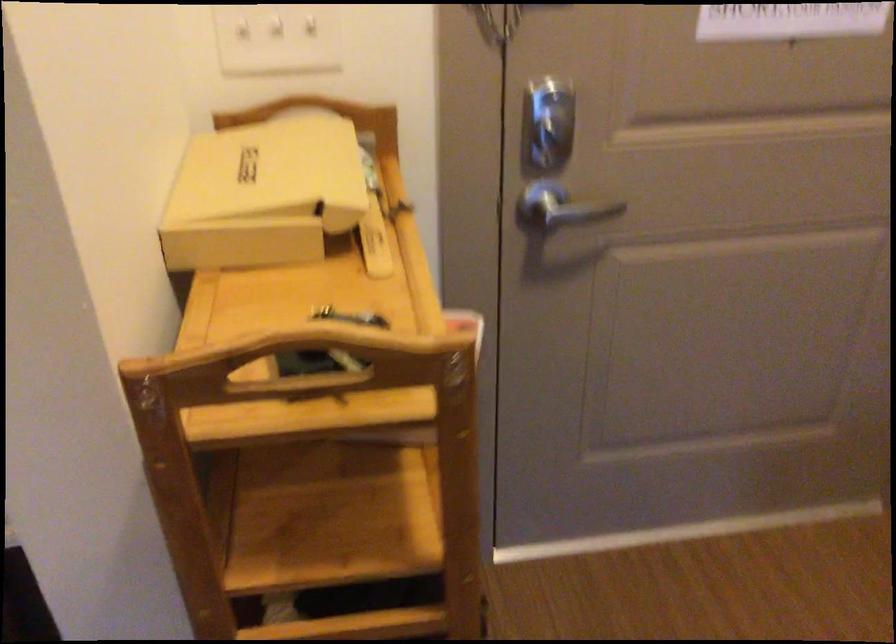
What do you see at coordinates (276, 39) in the screenshot? This screenshot has height=644, width=896. I see `the white light switch` at bounding box center [276, 39].